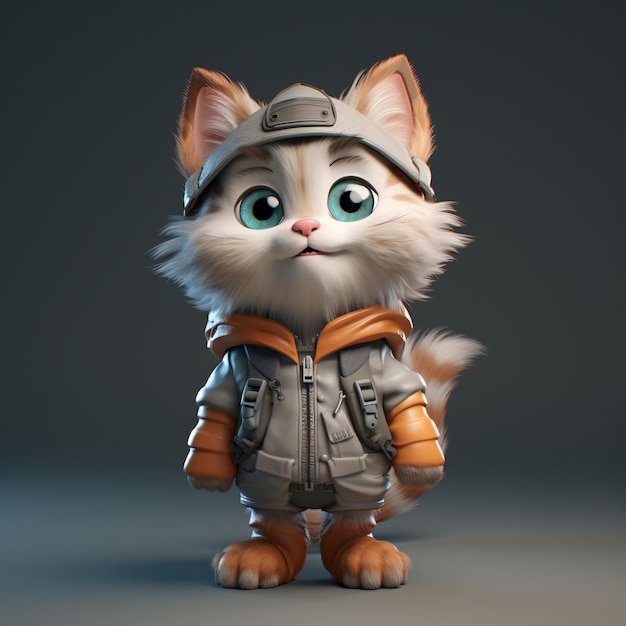
Where is `floor`? This screenshot has height=626, width=626. floor is located at coordinates (288, 605).